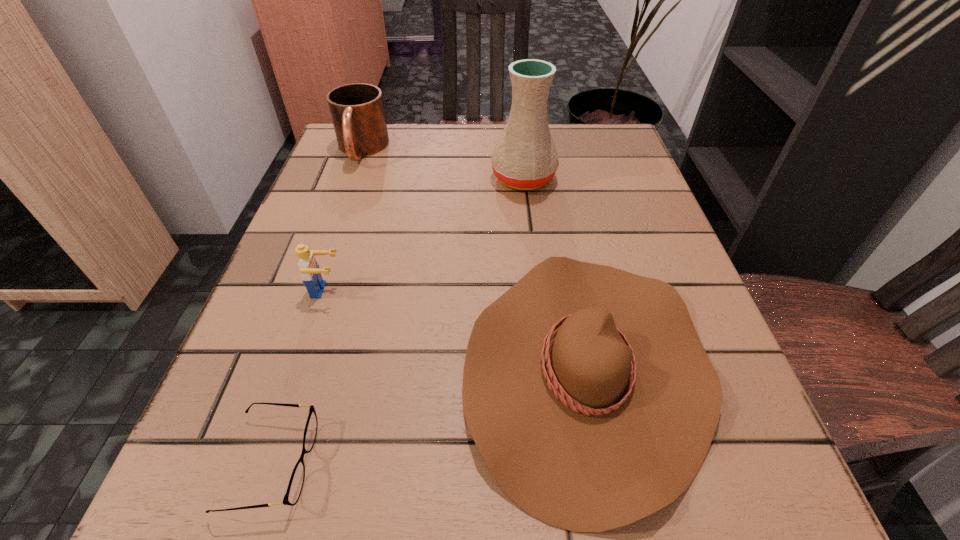
This screenshot has width=960, height=540. What are the coordinates of `free space that is in between the shortest object and the pottery` in the screenshot? It's located at (396, 321).

Image resolution: width=960 pixels, height=540 pixels. Find the location of `free space between the third shortest object and the tallest object`. free space between the third shortest object and the tallest object is located at coordinates pos(425,234).

The image size is (960, 540). In order to click on vacant point located between the mug and the Lego in this screenshot , I will do (x=344, y=220).

This screenshot has width=960, height=540. In order to click on unoccupied position between the Lego and the fourth shortest object in this screenshot , I will do `click(344, 220)`.

Identify the location of blank region between the shortest object and the fourth tallest object. The height and width of the screenshot is (540, 960). (429, 415).

What are the coordinates of `free spot between the third tallest object and the shortest object` in the screenshot? It's located at (299, 377).

You are a GUI agent. You are given a task and a screenshot of the screen. Output one action in this format:
    pyautogui.click(x=<x>, y=<y>)
    Task: Click on the object identified as the second closest to the third shortest object
    Image resolution: width=960 pixels, height=540 pixels.
    Given the screenshot: What is the action you would take?
    pyautogui.click(x=586, y=389)

The width and height of the screenshot is (960, 540). Find the location of `the third closest object to the mug`. the third closest object to the mug is located at coordinates (586, 389).

Locate an element on the screen. The height and width of the screenshot is (540, 960). vacant space that satisfies the following two spatial constraints: 1. on the face of the third shortest object; 2. on the left side of the second shortest object is located at coordinates (301, 368).

This screenshot has height=540, width=960. In order to click on free space that satisfies the following two spatial constraints: 1. on the side of the mug with the handle; 2. on the right side of the tallest object in this screenshot , I will do `click(351, 178)`.